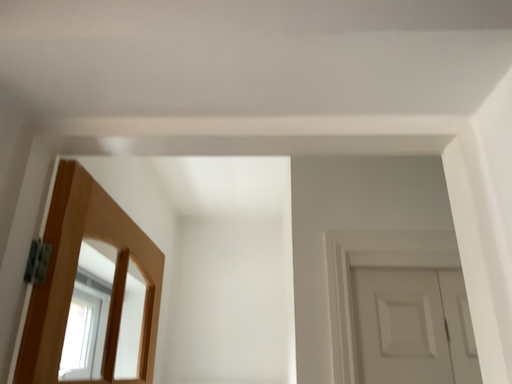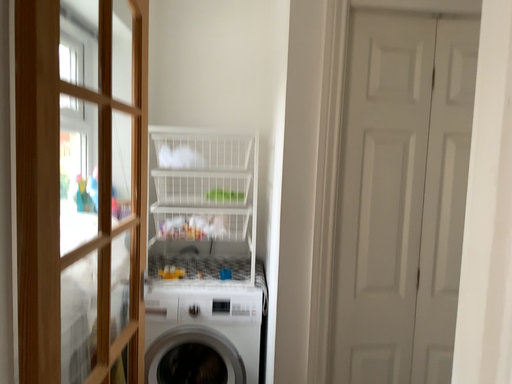
Question: How did the camera likely rotate when shooting the video?

Choices:
 (A) rotated upward
 (B) rotated downward

Answer: (B)